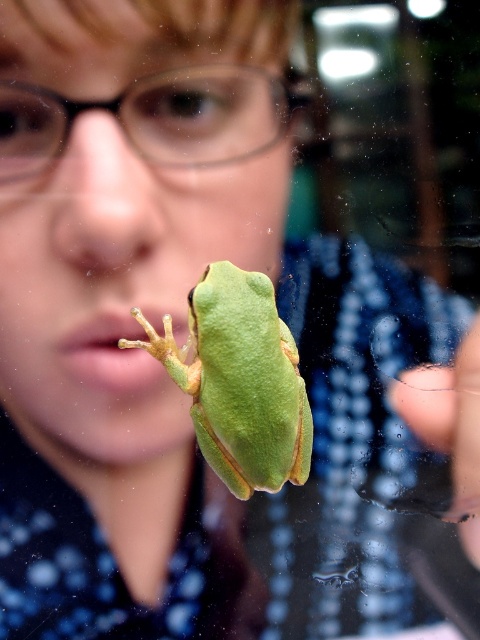
Who is taller, black plastic glasses at upper center or transparent glass finger at lower right?

transparent glass finger at lower right

Can you confirm if black plastic glasses at upper center is shorter than transparent glass finger at lower right?

Yes, black plastic glasses at upper center is shorter than transparent glass finger at lower right.

What are the coordinates of `black plastic glasses at upper center` in the screenshot? It's located at click(x=153, y=118).

Between green matte/fuzzy frog at center and transparent glass finger at lower right, which one is positioned higher?

green matte/fuzzy frog at center

This screenshot has width=480, height=640. Identify the location of green matte/fuzzy frog at center. (239, 380).

Identify the location of green matte/fuzzy frog at center. (239, 380).

In order to click on green matte/fuzzy frog at center in this screenshot , I will do `click(239, 380)`.

Does green matte/fuzzy frog at center have a lesser height compared to black plastic glasses at upper center?

No, green matte/fuzzy frog at center is not shorter than black plastic glasses at upper center.

Does green matte/fuzzy frog at center appear on the left side of black plastic glasses at upper center?

Incorrect, green matte/fuzzy frog at center is not on the left side of black plastic glasses at upper center.

Identify the location of green matte/fuzzy frog at center. (239, 380).